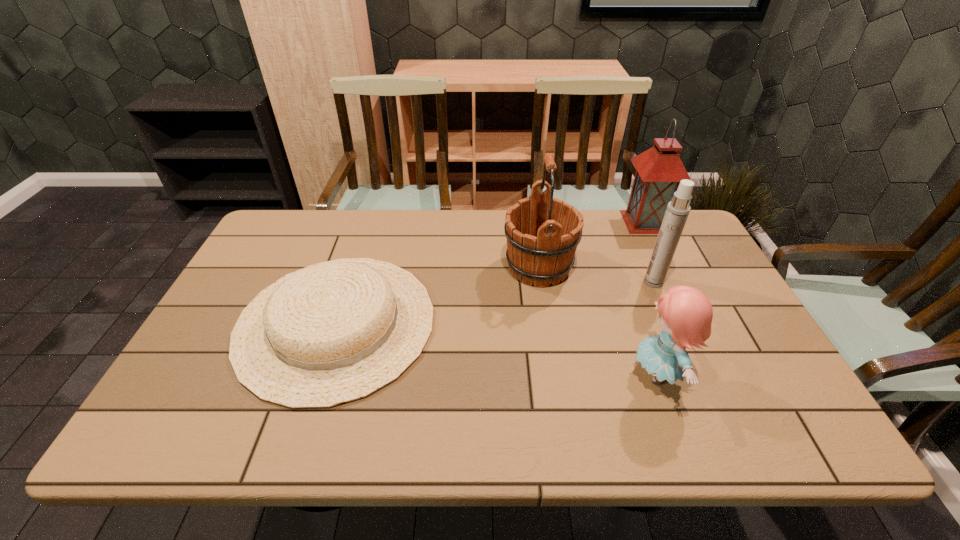
Find the location of a particular element. The height and width of the screenshot is (540, 960). free region that satisfies the following two spatial constraints: 1. on the back side of the sunhat; 2. on the left side of the second object from left to right is located at coordinates pos(354,267).